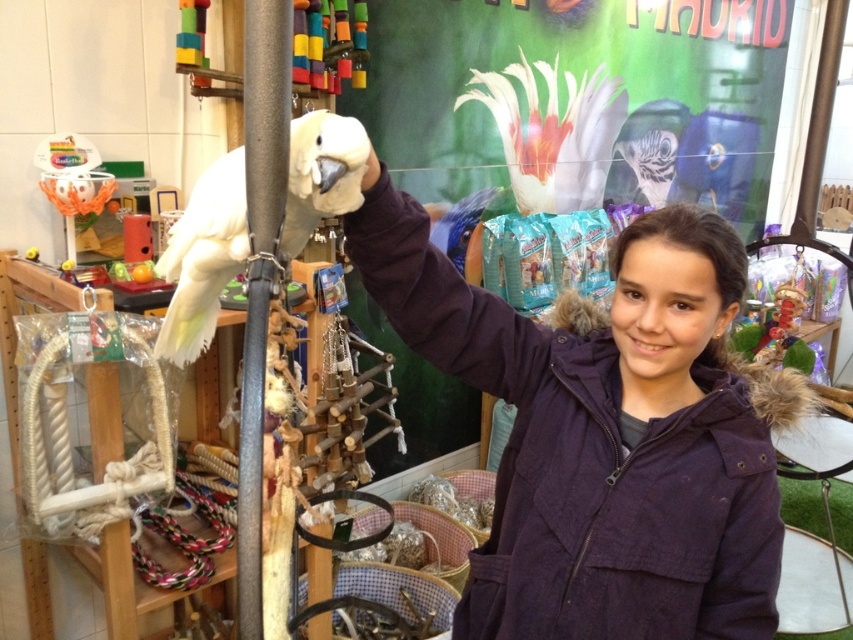
You are a delivery person who needs to place a new package between the purple cotton jacket at center and the black matte pole at center. The package measures 18 inches in length. Will there be enough space between them to fit the package?

The purple cotton jacket at center is 17.83 inches from the black matte pole at center. Since the package is 18 inches long, it will not fit between them as the distance is slightly shorter than the package length.

You are a customer in the pet store and want to place a new bird toy between the white feathered parrot at center and the black matte pole at center. According to the scene description, where should you place the toy so it is between them?

The white feathered parrot at center is positioned on the left side of the black matte pole at center, so you should place the new bird toy to the right of the parrot and to the left of the pole to place it between them.